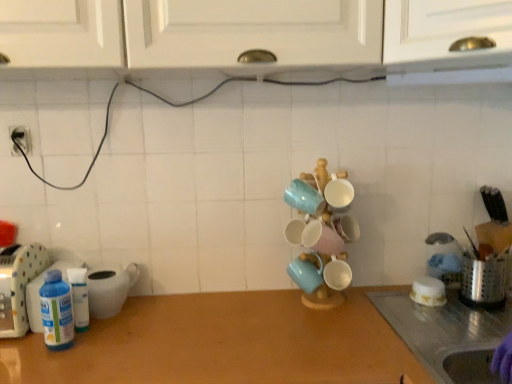
Question: From the image's perspective, is matte ceramic mugs at center, the second tableware viewed from the left, beneath metallic silver utensil holder at right, the first appliance from the right?

Choices:
 (A) yes
 (B) no

Answer: (B)

Question: From a real-world perspective, is matte ceramic mugs at center, the second tableware viewed from the left, positioned under metallic silver utensil holder at right, the first appliance from the right, based on gravity?

Choices:
 (A) no
 (B) yes

Answer: (A)

Question: Can you confirm if matte ceramic mugs at center, the second tableware viewed from the left, is bigger than metallic silver utensil holder at right, the 4th appliance positioned from the left?

Choices:
 (A) yes
 (B) no

Answer: (A)

Question: Considering the relative positions of matte ceramic mugs at center, the second tableware viewed from the right, and metallic silver utensil holder at right, the 4th appliance positioned from the left, in the image provided, is matte ceramic mugs at center, the second tableware viewed from the right, to the left of metallic silver utensil holder at right, the 4th appliance positioned from the left, from the viewer's perspective?

Choices:
 (A) yes
 (B) no

Answer: (A)

Question: From the image's perspective, is matte ceramic mugs at center, the second tableware viewed from the right, above metallic silver utensil holder at right, the 4th appliance positioned from the left?

Choices:
 (A) no
 (B) yes

Answer: (B)

Question: Would you say white glossy cabinet at upper center is inside or outside wooden at center?

Choices:
 (A) inside
 (B) outside

Answer: (B)

Question: Is point [126, 24] closer or farther from the camera than point [154, 322]?

Choices:
 (A) farther
 (B) closer

Answer: (B)

Question: Visually, is white glossy cabinet at upper center positioned to the left or to the right of wooden at center?

Choices:
 (A) right
 (B) left

Answer: (B)

Question: Considering the positions of white glossy cabinet at upper center and wooden at center in the image, is white glossy cabinet at upper center bigger or smaller than wooden at center?

Choices:
 (A) big
 (B) small

Answer: (A)

Question: Is point (0, 322) positioned closer to the camera than point (317, 180)?

Choices:
 (A) farther
 (B) closer

Answer: (B)

Question: From the image's perspective, is white plastic bottle at left, which is counted as the fourth appliance, starting from the right, above or below matte ceramic mugs at center, the second tableware viewed from the right?

Choices:
 (A) below
 (B) above

Answer: (A)

Question: In the image, is white plastic bottle at left, the 1th appliance in the left-to-right sequence, positioned in front of or behind matte ceramic mugs at center, the second tableware viewed from the right?

Choices:
 (A) front
 (B) behind

Answer: (A)

Question: Visually, is white plastic bottle at left, the 1th appliance in the left-to-right sequence, positioned to the left or to the right of matte ceramic mugs at center, the second tableware viewed from the left?

Choices:
 (A) right
 (B) left

Answer: (B)

Question: In the image, is white glossy cabinet at upper center on the left side or the right side of white glossy bowl at right, which appears as the first tableware when viewed from the right?

Choices:
 (A) left
 (B) right

Answer: (A)

Question: From the image's perspective, is white glossy cabinet at upper center positioned above or below white glossy bowl at right, which appears as the first tableware when viewed from the right?

Choices:
 (A) above
 (B) below

Answer: (A)